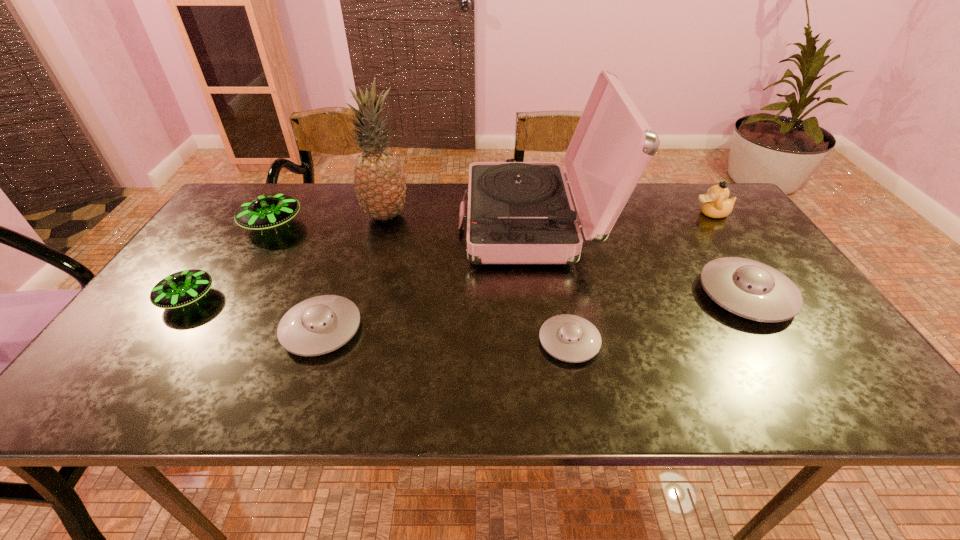
This screenshot has height=540, width=960. I want to click on the second smallest gray saucer, so click(318, 325).

I want to click on the shortest saucer, so click(570, 338).

What are the coordinates of `the shortest object` in the screenshot? It's located at (570, 338).

This screenshot has width=960, height=540. Identify the location of free space located 0.290m on the right of the pineapple. (505, 216).

Find the location of a particular element. free spot located with the lid open on the record player is located at coordinates (389, 223).

What are the coordinates of `free location located 0.400m with the lid open on the record player` in the screenshot? It's located at (325, 223).

Identify the location of free space located with the lid open on the record player. (359, 223).

Identify the location of free space located on the face of the duckling. (660, 213).

The height and width of the screenshot is (540, 960). In order to click on vacant space located on the face of the duckling in this screenshot , I will do `click(648, 213)`.

The height and width of the screenshot is (540, 960). What are the coordinates of `free space located on the face of the duckling` in the screenshot? It's located at (629, 213).